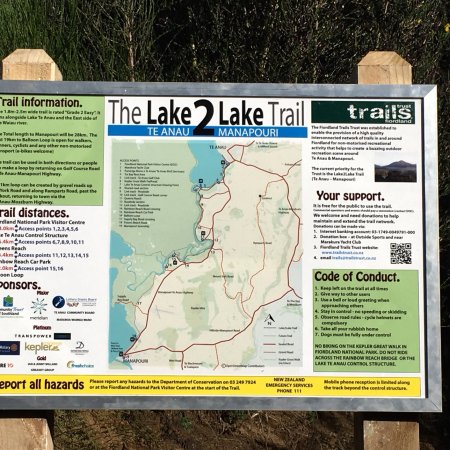
Where is `bottom edge of map`? The width and height of the screenshot is (450, 450). bottom edge of map is located at coordinates (214, 375).